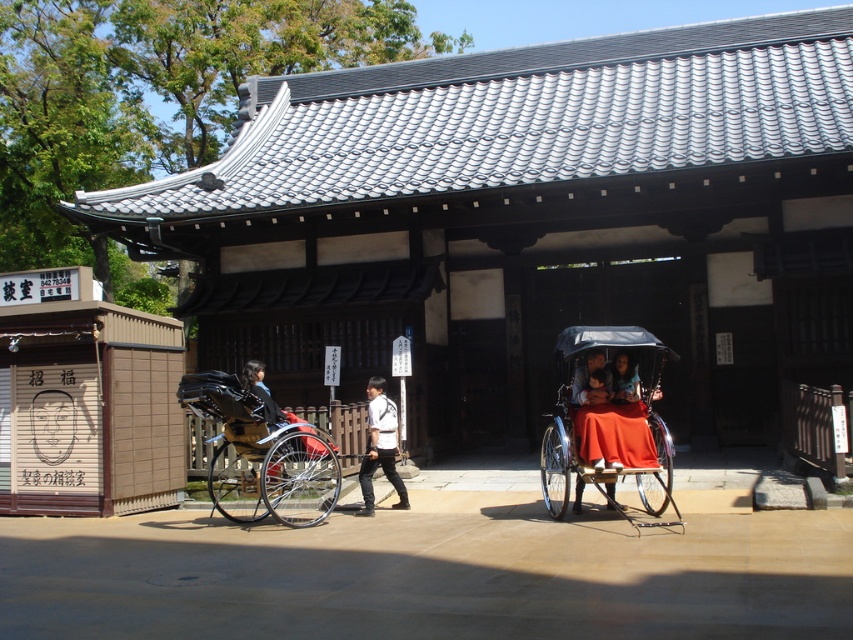
Question: Which of the following is the closest to the observer?

Choices:
 (A) orange fabric covered cart at center
 (B) wooden cart at center

Answer: (A)

Question: Can you confirm if orange fabric covered cart at center is smaller than white matte shirt at center?

Choices:
 (A) no
 (B) yes

Answer: (A)

Question: Is wooden cart at center positioned before white matte shirt at center?

Choices:
 (A) yes
 (B) no

Answer: (A)

Question: Does orange fabric covered cart at center appear on the right side of wooden cart at center?

Choices:
 (A) yes
 (B) no

Answer: (A)

Question: Estimate the real-world distances between objects in this image. Which object is farther from the white matte shirt at center?

Choices:
 (A) orange fabric covered cart at center
 (B) wooden cart at center

Answer: (A)

Question: Which object appears farthest from the camera in this image?

Choices:
 (A) wooden cart at center
 (B) orange fabric covered cart at center

Answer: (A)